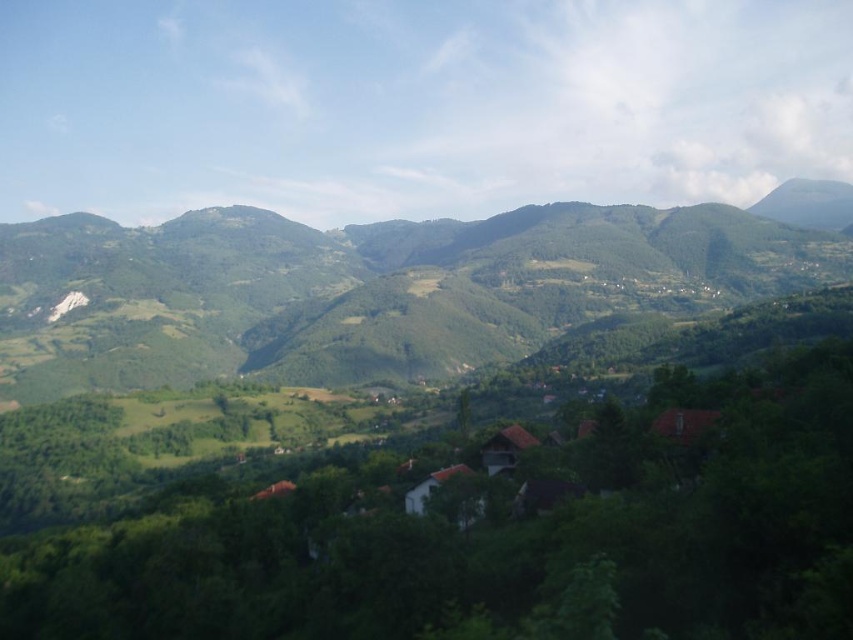
You are a hiker planning to take a photo of the brown tiled roofs at center and the green textured hillside at center. Based on their positions, which object should you frame first in your camera viewfinder to capture both in a single shot?

The brown tiled roofs at center should be framed first since the green textured hillside at center is positioned to the right of it, allowing both to be included in the shot by adjusting the viewfinder to the left.

You are standing at the point marked as point [376,288] in the image. What do you see directly below you?

At point [376,288] lies green textured hillside at center, so you see green textured hillside at center directly below you.